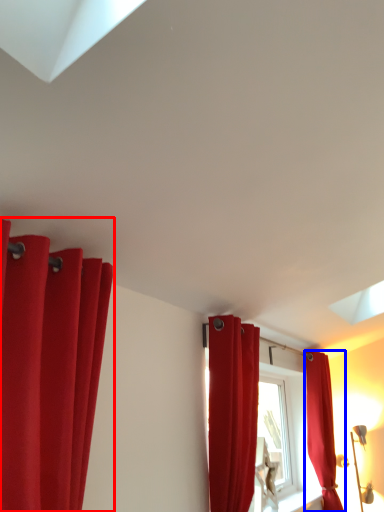
Question: Among these objects, which one is nearest to the camera, curtain (highlighted by a red box) or curtain (highlighted by a blue box)?

Choices:
 (A) curtain
 (B) curtain

Answer: (A)